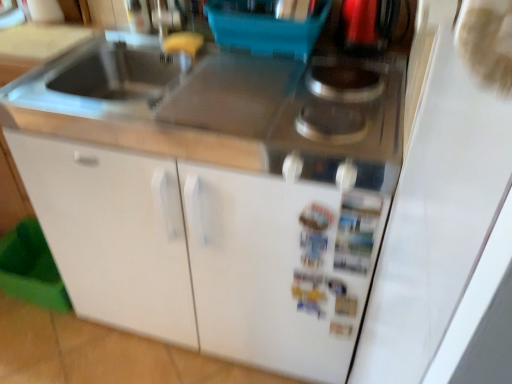
Question: In terms of height, does white matte cabinet at center, marked as the 2th cabinetry in a left-to-right arrangement, look taller or shorter compared to white matte cabinet at lower left, acting as the 1th cabinetry starting from the left?

Choices:
 (A) short
 (B) tall

Answer: (A)

Question: Based on their sizes in the image, would you say white matte cabinet at center, which is the 1th cabinetry in right-to-left order, is bigger or smaller than white matte cabinet at lower left, which ranks as the 2th cabinetry in right-to-left order?

Choices:
 (A) small
 (B) big

Answer: (A)

Question: Which is nearer to the white matte cabinet at lower left, acting as the 1th cabinetry starting from the left?

Choices:
 (A) white matte cabinet at center, which is the 1th cabinetry in right-to-left order
 (B) metallic silver gas stove at upper right

Answer: (A)

Question: Estimate the real-world distances between objects in this image. Which object is farther from the white matte cabinet at center, marked as the 2th cabinetry in a left-to-right arrangement?

Choices:
 (A) metallic silver gas stove at upper right
 (B) white matte cabinet at lower left, acting as the 1th cabinetry starting from the left

Answer: (A)